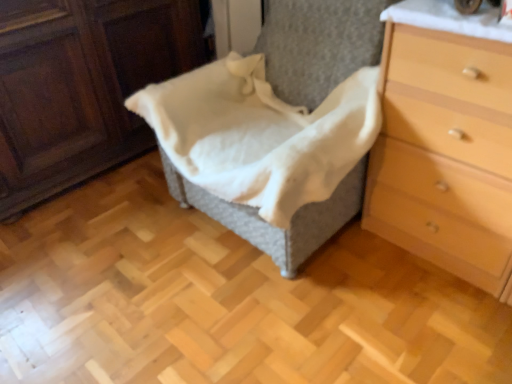
Question: Does light brown wood chest of drawers at right lie behind white cotton blanket at center?

Choices:
 (A) no
 (B) yes

Answer: (A)

Question: Is light brown wood chest of drawers at right bigger than white cotton blanket at center?

Choices:
 (A) no
 (B) yes

Answer: (B)

Question: Considering the relative sizes of light brown wood chest of drawers at right and white cotton blanket at center in the image provided, is light brown wood chest of drawers at right wider than white cotton blanket at center?

Choices:
 (A) yes
 (B) no

Answer: (B)

Question: Can you confirm if light brown wood chest of drawers at right is thinner than white cotton blanket at center?

Choices:
 (A) yes
 (B) no

Answer: (A)

Question: Is light brown wood chest of drawers at right surrounding white cotton blanket at center?

Choices:
 (A) yes
 (B) no

Answer: (B)

Question: Is point (391, 228) positioned closer to the camera than point (163, 87)?

Choices:
 (A) farther
 (B) closer

Answer: (A)

Question: Is light brown wood chest of drawers at right wider or thinner than white cotton blanket at center?

Choices:
 (A) thin
 (B) wide

Answer: (A)

Question: In terms of height, does light brown wood chest of drawers at right look taller or shorter compared to white cotton blanket at center?

Choices:
 (A) tall
 (B) short

Answer: (A)

Question: Relative to white cotton blanket at center, is light brown wood chest of drawers at right in front or behind?

Choices:
 (A) front
 (B) behind

Answer: (A)

Question: Is light brown wood chest of drawers at right bigger or smaller than woven fabric basket at center?

Choices:
 (A) small
 (B) big

Answer: (A)

Question: Is light brown wood chest of drawers at right inside or outside of woven fabric basket at center?

Choices:
 (A) inside
 (B) outside

Answer: (B)

Question: From a real-world perspective, is light brown wood chest of drawers at right above or below woven fabric basket at center?

Choices:
 (A) below
 (B) above

Answer: (A)

Question: Is point (396, 112) positioned closer to the camera than point (66, 168)?

Choices:
 (A) farther
 (B) closer

Answer: (B)

Question: Looking at their shapes, would you say white cotton blanket at center is wider or thinner than woven fabric basket at center?

Choices:
 (A) thin
 (B) wide

Answer: (B)

Question: Is white cotton blanket at center bigger or smaller than woven fabric basket at center?

Choices:
 (A) small
 (B) big

Answer: (A)